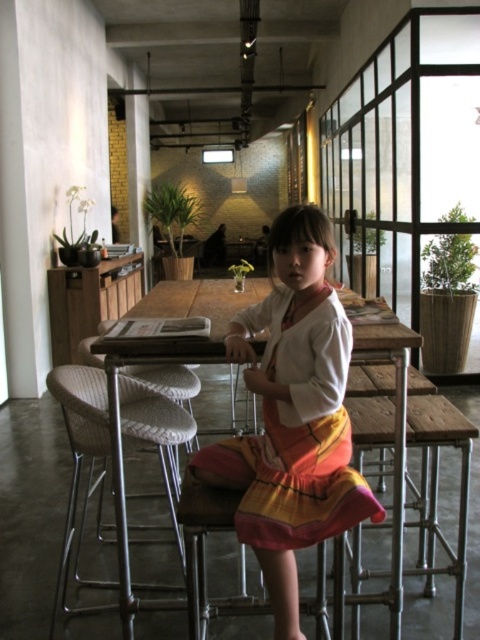
Question: Considering the real-world distances, which object is closest to the white fabric chair at lower left?

Choices:
 (A) wooden table at center
 (B) white fabric chair at center

Answer: (B)

Question: Can you confirm if yellow-orange cotton dress at center is thinner than metallic silver bar stool at center?

Choices:
 (A) yes
 (B) no

Answer: (B)

Question: Does yellow-orange cotton dress at center appear over white fabric chair at center?

Choices:
 (A) no
 (B) yes

Answer: (B)

Question: Among these objects, which one is farthest from the camera?

Choices:
 (A) metallic silver bar stool at center
 (B) wooden table at center
 (C) white fabric chair at lower left

Answer: (C)

Question: Can you confirm if metallic silver bar stool at center is positioned to the right of white fabric chair at center?

Choices:
 (A) yes
 (B) no

Answer: (A)

Question: Which point is farther to the camera?

Choices:
 (A) white fabric chair at lower left
 (B) white fabric chair at center

Answer: (B)